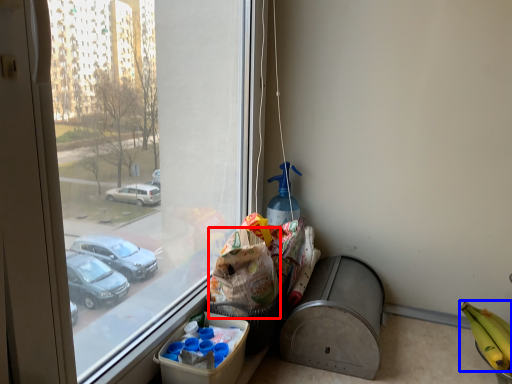
Question: Which of the following is the closest to the observer, grocery bag (highlighted by a red box) or banana (highlighted by a blue box)?

Choices:
 (A) grocery bag
 (B) banana

Answer: (B)